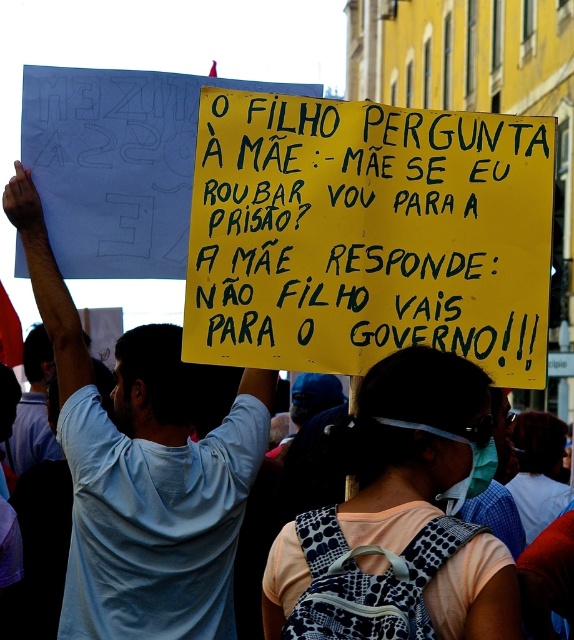
Question: Where is yellow paper sign at center located in relation to light blue t-shirt at upper left in the image?

Choices:
 (A) left
 (B) right

Answer: (B)

Question: Among these points, which one is farthest from the camera?

Choices:
 (A) (406, 124)
 (B) (44, 301)

Answer: (B)

Question: Does yellow paper sign at center have a lesser width compared to light blue t-shirt at upper left?

Choices:
 (A) no
 (B) yes

Answer: (A)

Question: Is yellow paper sign at center wider than light blue t-shirt at upper left?

Choices:
 (A) yes
 (B) no

Answer: (A)